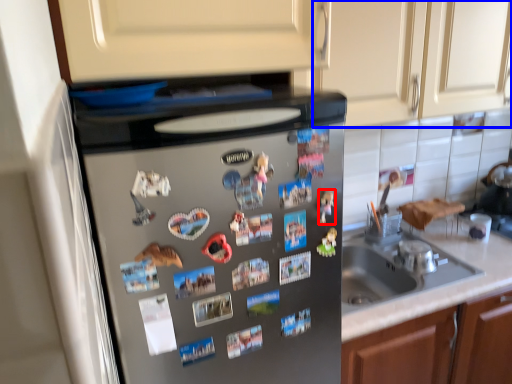
Question: Which of the following is the farthest to the observer, toy (highlighted by a red box) or cabinetry (highlighted by a blue box)?

Choices:
 (A) toy
 (B) cabinetry

Answer: (B)